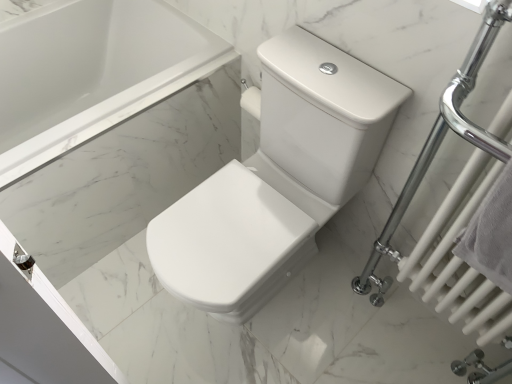
Question: Is white glossy toilet at center bigger than white marble bathtub at upper left?

Choices:
 (A) no
 (B) yes

Answer: (A)

Question: Is white glossy toilet at center beside white marble bathtub at upper left?

Choices:
 (A) yes
 (B) no

Answer: (B)

Question: Considering the relative positions of white glossy toilet at center and white marble bathtub at upper left in the image provided, is white glossy toilet at center to the right of white marble bathtub at upper left from the viewer's perspective?

Choices:
 (A) yes
 (B) no

Answer: (A)

Question: Considering the relative sizes of white glossy toilet at center and white marble bathtub at upper left in the image provided, is white glossy toilet at center taller than white marble bathtub at upper left?

Choices:
 (A) yes
 (B) no

Answer: (A)

Question: Is white glossy toilet at center looking in the opposite direction of white marble bathtub at upper left?

Choices:
 (A) no
 (B) yes

Answer: (A)

Question: From a real-world perspective, is white glossy toilet at center physically below white marble bathtub at upper left?

Choices:
 (A) yes
 (B) no

Answer: (B)

Question: Does white glossy towel rack at right lie in front of white cotton towel at right?

Choices:
 (A) no
 (B) yes

Answer: (B)

Question: From a real-world perspective, is white glossy towel rack at right beneath white cotton towel at right?

Choices:
 (A) no
 (B) yes

Answer: (B)

Question: Considering the relative sizes of white glossy towel rack at right and white cotton towel at right in the image provided, is white glossy towel rack at right bigger than white cotton towel at right?

Choices:
 (A) no
 (B) yes

Answer: (B)

Question: Does white glossy towel rack at right turn towards white cotton towel at right?

Choices:
 (A) yes
 (B) no

Answer: (A)

Question: Considering the relative sizes of white glossy towel rack at right and white cotton towel at right in the image provided, is white glossy towel rack at right wider than white cotton towel at right?

Choices:
 (A) no
 (B) yes

Answer: (B)

Question: Is white glossy towel rack at right positioned beyond the bounds of white cotton towel at right?

Choices:
 (A) no
 (B) yes

Answer: (B)

Question: Considering the relative sizes of white glossy toilet at center and white cotton towel at right in the image provided, is white glossy toilet at center smaller than white cotton towel at right?

Choices:
 (A) yes
 (B) no

Answer: (B)